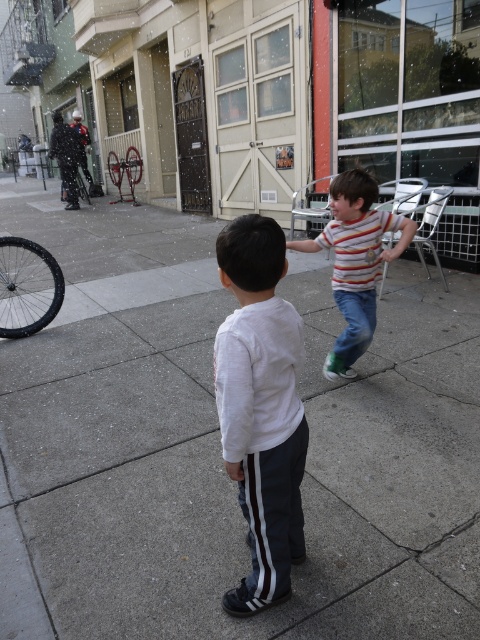
You are a photographer trying to capture both the white matte shirt at center and the black rubber tire at left in the same frame. Based on their sizes in the image, which object would appear smaller in the final photo?

The white matte shirt at center appears smaller in the photo because it is described as thinner than the black rubber tire at left.

You are a pedestrian standing on the sidewalk in the image. You need to cross the street safely. Which object should you look at first before stepping into the road, the white matte shirt at center or the black rubber tire at left?

The white matte shirt at center is in front of the black rubber tire at left, so you should look at the white matte shirt at center first before stepping into the road because it is closer to you.